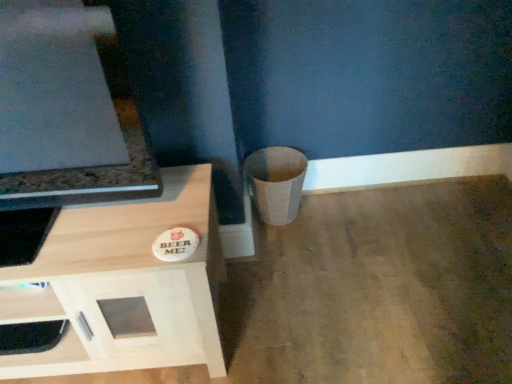
Where is `vacant area located to the right-hand side of light wood cabinet at lower left`? Image resolution: width=512 pixels, height=384 pixels. vacant area located to the right-hand side of light wood cabinet at lower left is located at coordinates [297, 306].